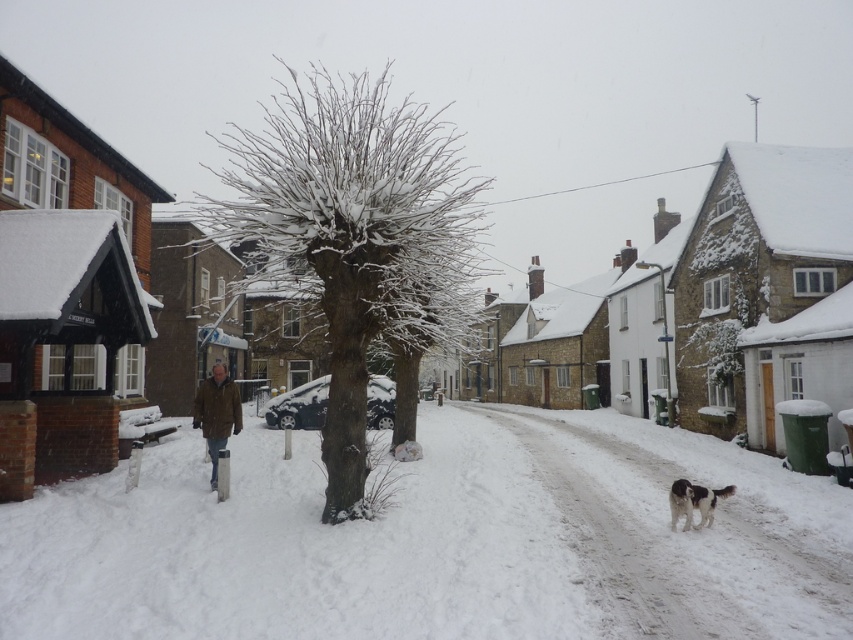
You are a photographer trying to capture the white fluffy snow at center and the white fluffy dog at lower right in a single frame. Based on their sizes in the image, which one would appear larger in the photo?

The white fluffy snow at center might be wider than white fluffy dog at lower right, so the snow at center would likely appear larger in the photo.

You are an observer standing in the winter scene and want to know where the white fluffy snow at center is in relation to the white fluffy dog at lower right. Can you determine if the snow is above or below the dog?

The white fluffy snow at center is located below the white fluffy dog at lower right, so the snow is below the dog.